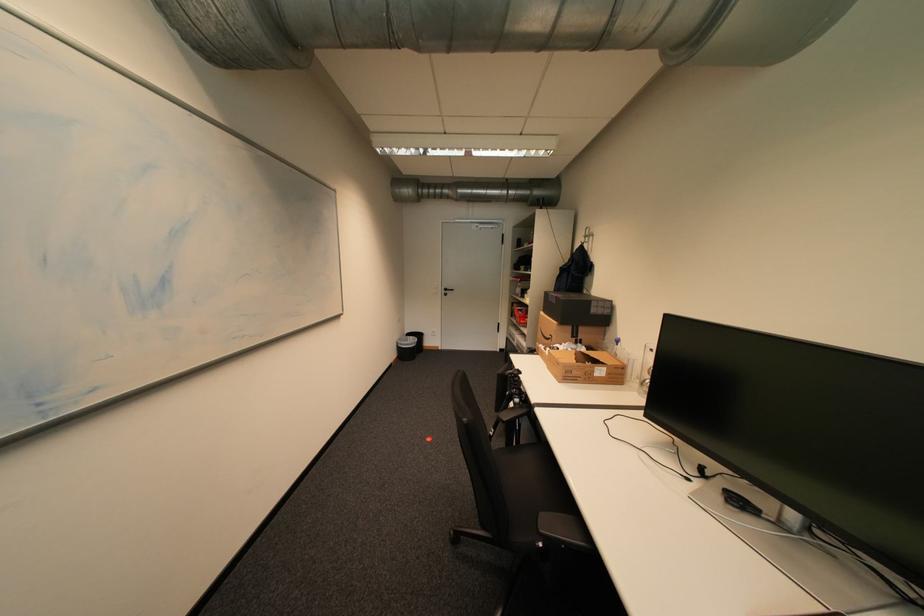
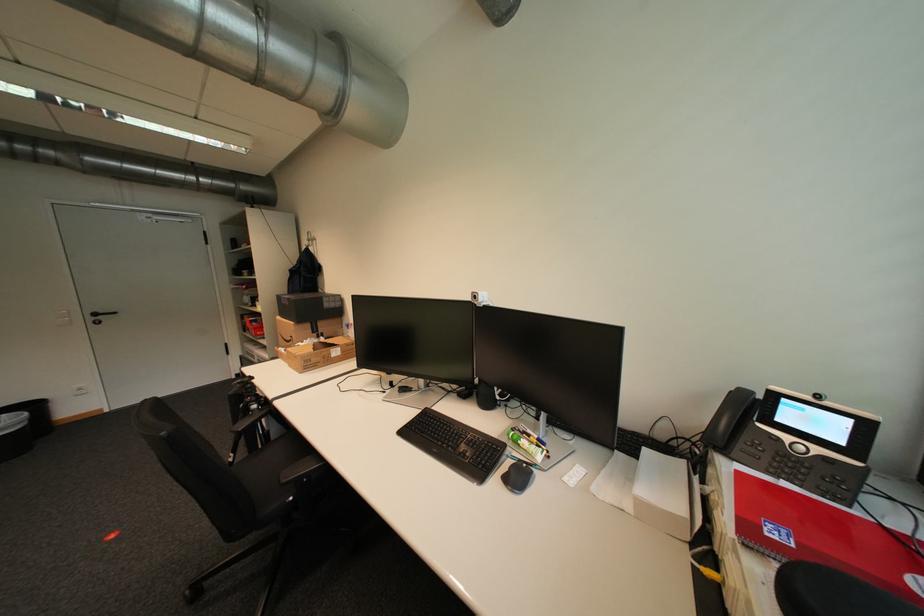
In the second image, find the point that corresponds to point 525,397 in the first image.

(261, 403)